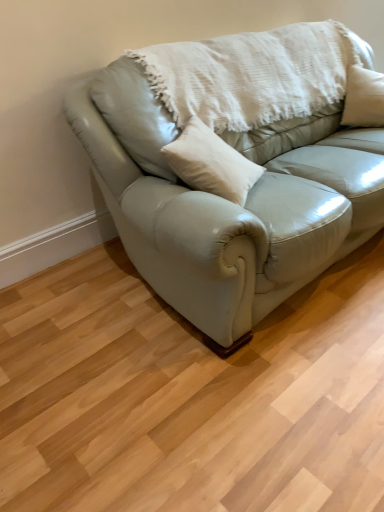
Question: Considering the relative sizes of white textured blanket at upper center and light gray leather couch at center in the image provided, is white textured blanket at upper center thinner than light gray leather couch at center?

Choices:
 (A) no
 (B) yes

Answer: (B)

Question: From the image's perspective, is white textured blanket at upper center above light gray leather couch at center?

Choices:
 (A) yes
 (B) no

Answer: (A)

Question: Is white textured blanket at upper center outside light gray leather couch at center?

Choices:
 (A) yes
 (B) no

Answer: (B)

Question: Is light gray leather couch at center surrounded by white textured blanket at upper center?

Choices:
 (A) yes
 (B) no

Answer: (B)

Question: Is white textured blanket at upper center looking in the opposite direction of light gray leather couch at center?

Choices:
 (A) yes
 (B) no

Answer: (A)

Question: Is white textured blanket at upper center to the left of light gray leather couch at center from the viewer's perspective?

Choices:
 (A) yes
 (B) no

Answer: (A)

Question: Is light gray leather couch at center wider than white textured blanket at upper center?

Choices:
 (A) yes
 (B) no

Answer: (A)

Question: Does light gray leather couch at center have a greater height compared to white textured blanket at upper center?

Choices:
 (A) yes
 (B) no

Answer: (A)

Question: Is the position of light gray leather couch at center more distant than that of white textured blanket at upper center?

Choices:
 (A) no
 (B) yes

Answer: (A)

Question: From a real-world perspective, is light gray leather couch at center positioned under white textured blanket at upper center based on gravity?

Choices:
 (A) yes
 (B) no

Answer: (A)

Question: From the image's perspective, is light gray leather couch at center over white textured blanket at upper center?

Choices:
 (A) yes
 (B) no

Answer: (B)

Question: Is light gray leather couch at center to the right of white textured blanket at upper center from the viewer's perspective?

Choices:
 (A) no
 (B) yes

Answer: (B)

Question: Considering the positions of point (188, 117) and point (240, 303), is point (188, 117) closer or farther from the camera than point (240, 303)?

Choices:
 (A) closer
 (B) farther

Answer: (B)